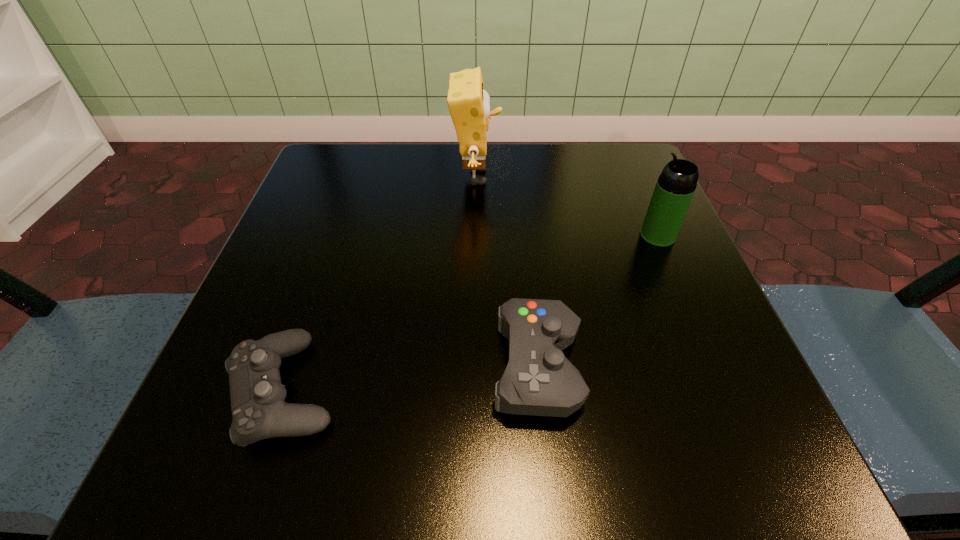
I want to click on blank space located on the left of the right control, so click(450, 367).

This screenshot has height=540, width=960. What are the coordinates of `blank space located 0.050m on the back of the left control` in the screenshot? It's located at point(311,312).

Where is `object at the far edge`? Image resolution: width=960 pixels, height=540 pixels. object at the far edge is located at coordinates (469, 104).

Find the location of `object that is at the left edge`. object that is at the left edge is located at coordinates (259, 410).

Identify the location of object at the right edge. (676, 185).

At what (x,y) coordinates should I click in order to perform the action: click on object at the near left corner. Please return your answer as a coordinate pair (x, y). Image resolution: width=960 pixels, height=540 pixels. Looking at the image, I should click on (259, 410).

The width and height of the screenshot is (960, 540). What are the coordinates of `vacant space at the far edge` in the screenshot? It's located at (455, 172).

Image resolution: width=960 pixels, height=540 pixels. I want to click on vacant area at the near edge, so click(601, 418).

In the image, there is a desktop. Where is `vacant space at the left edge`? This screenshot has height=540, width=960. vacant space at the left edge is located at coordinates (241, 329).

Identify the location of vacant space at the right edge of the desktop. The image size is (960, 540). (635, 299).